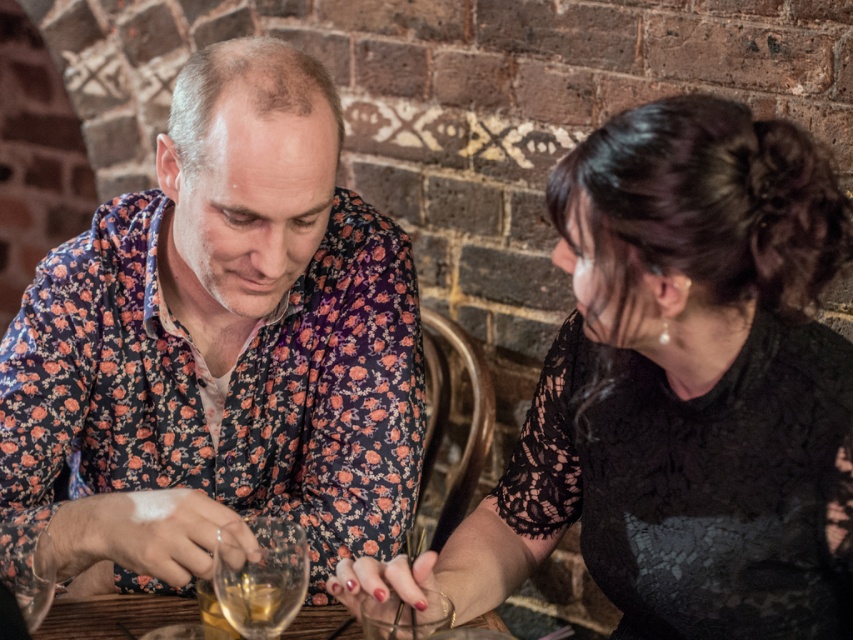
Is black lace dress at center bigger than wooden table at center?

Yes, black lace dress at center is bigger than wooden table at center.

Is black lace dress at center behind wooden table at center?

No, it is not.

Does point (827, 225) lie behind point (154, 608)?

That is False.

In order to click on black lace dress at center in this screenshot , I will do `click(677, 388)`.

Who is more distant from viewer, [262,547] or [165,598]?

The point [165,598] is behind.

Does clear glass at lower center appear on the left side of wooden table at center?

Yes, clear glass at lower center is to the left of wooden table at center.

Locate an element on the screen. clear glass at lower center is located at coordinates (260, 576).

Which is more to the right, floral-patterned shirt at center or clear glass at lower center?

clear glass at lower center

Is point (166, 202) less distant than point (235, 580)?

No.

This screenshot has height=640, width=853. In order to click on floral-patterned shirt at center in this screenshot , I will do `click(219, 344)`.